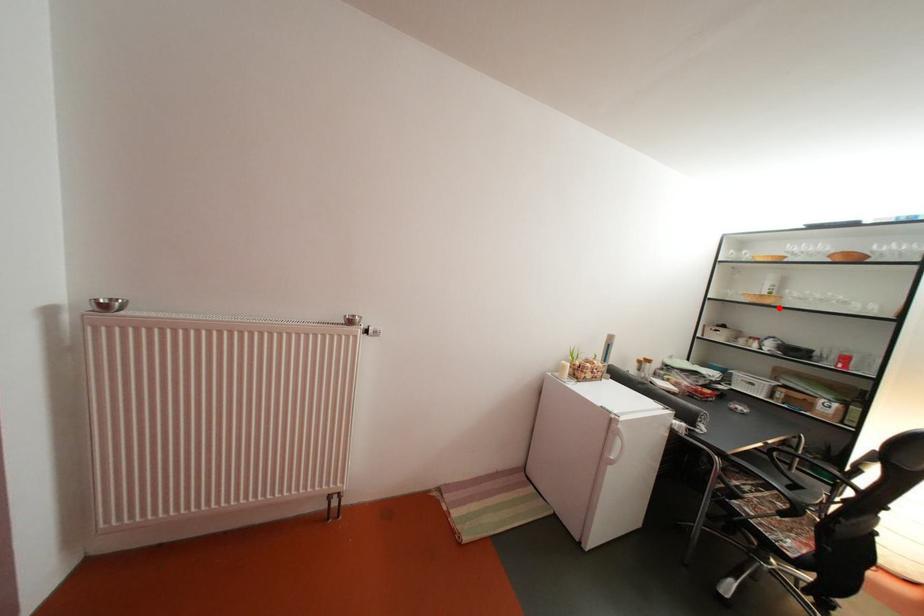
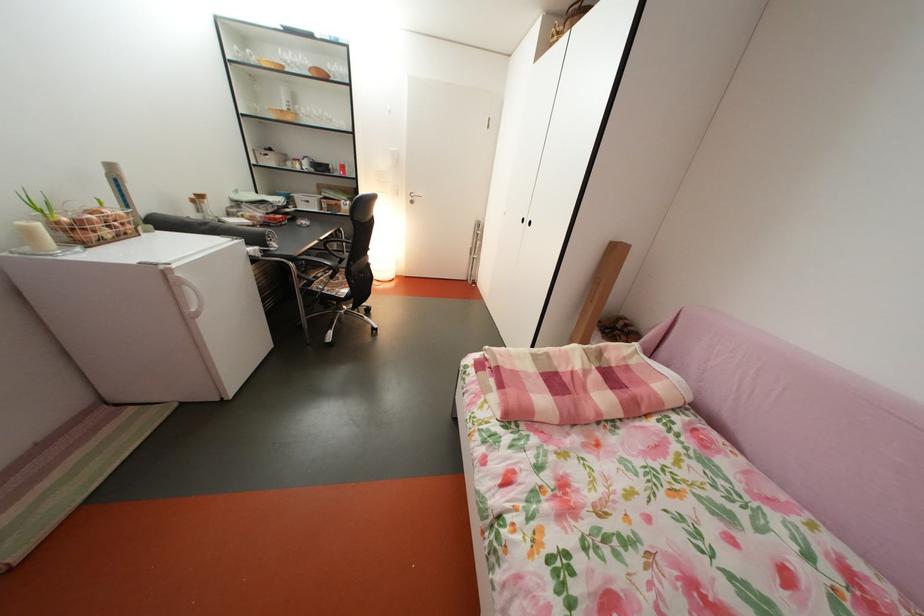
Question: A red point is marked in image1. In image2, is the corresponding 3D point closer to the camera or farther? Reply with the corresponding letter.

Choices:
 (A) The corresponding 3D point is closer.
 (B) The corresponding 3D point is farther.

Answer: (A)